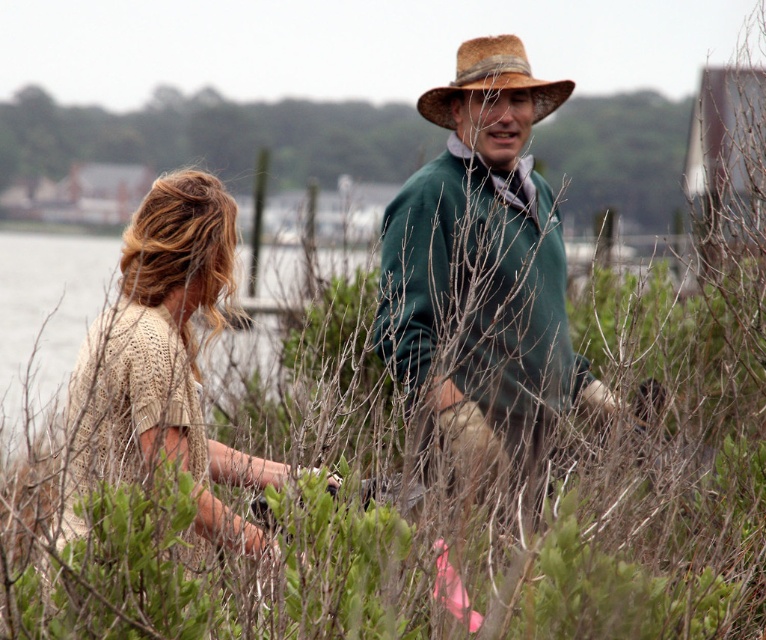
Which is in front, point (486, 291) or point (116, 337)?

Point (116, 337)

The image size is (766, 640). What do you see at coordinates (480, 304) in the screenshot?
I see `knitted beige sweater at center` at bounding box center [480, 304].

Identify the location of knitted beige sweater at center. The image size is (766, 640). (480, 304).

Which is in front, point (460, 99) or point (470, 49)?

Point (460, 99) is in front.

Is knitted beige sweater at center closer to camera compared to brown straw cowboy hat at upper center?

That is True.

The image size is (766, 640). What are the coordinates of `knitted beige sweater at center` in the screenshot? It's located at (480, 304).

Is green matte sweater at center shorter than brown straw cowboy hat at upper center?

In fact, green matte sweater at center may be taller than brown straw cowboy hat at upper center.

Is point (431, 99) positioned behind point (449, 84)?

No, (431, 99) is closer to viewer.

Where is `green matte sweater at center`? green matte sweater at center is located at coordinates (483, 280).